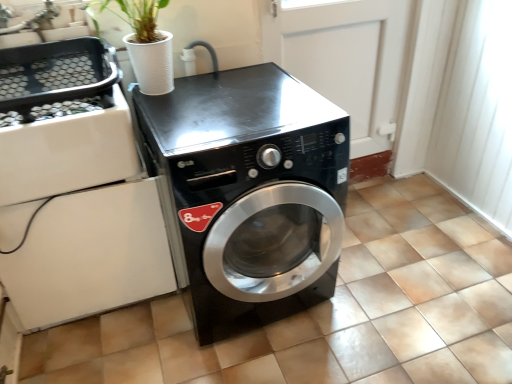
Where is `free location to the right of white glossy door at center`? free location to the right of white glossy door at center is located at coordinates (388, 194).